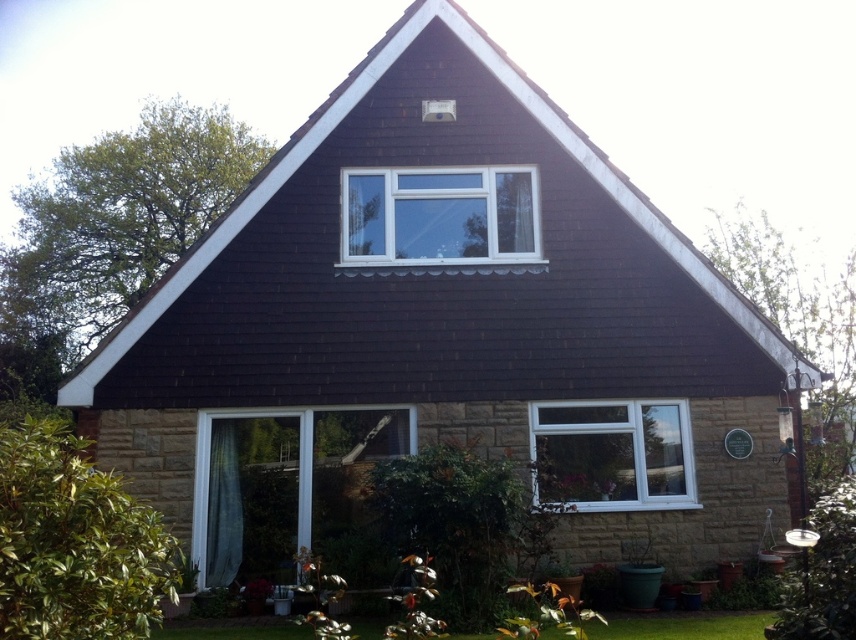
Can you confirm if white plastic window at center is positioned to the left of green grass at lower center?

Correct, you'll find white plastic window at center to the left of green grass at lower center.

Is white plastic window at center thinner than green grass at lower center?

No.

Which is behind, point (408, 216) or point (361, 630)?

The point (408, 216) is more distant.

Identify the location of white plastic window at center. The width and height of the screenshot is (856, 640). (438, 214).

Looking at this image, is transparent glass window at lower center behind green grass at lower center?

Yes, it is.

Between transparent glass window at lower center and green grass at lower center, which one is positioned lower?

green grass at lower center

At what (x,y) coordinates should I click in order to perform the action: click on transparent glass window at lower center. Please return your answer as a coordinate pair (x, y). This screenshot has width=856, height=640. Looking at the image, I should click on (284, 484).

Find the location of a particular element. The image size is (856, 640). transparent glass window at lower center is located at coordinates (284, 484).

Is white plastic window at lower right shorter than green grass at lower center?

Incorrect, white plastic window at lower right's height does not fall short of green grass at lower center's.

Is the position of white plastic window at lower right more distant than that of green grass at lower center?

Yes, white plastic window at lower right is behind green grass at lower center.

Where is `white plastic window at lower right`? Image resolution: width=856 pixels, height=640 pixels. white plastic window at lower right is located at coordinates (617, 452).